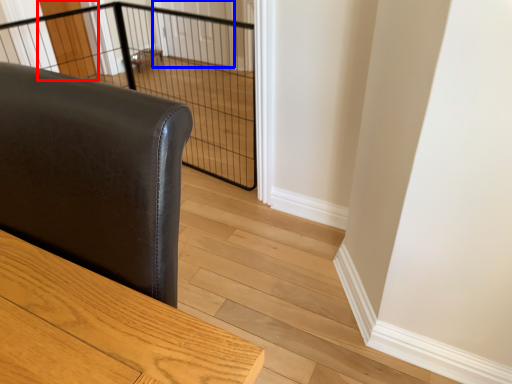
Question: Which of the following is the closest to the observer, screen door (highlighted by a red box) or screen door (highlighted by a blue box)?

Choices:
 (A) screen door
 (B) screen door

Answer: (A)